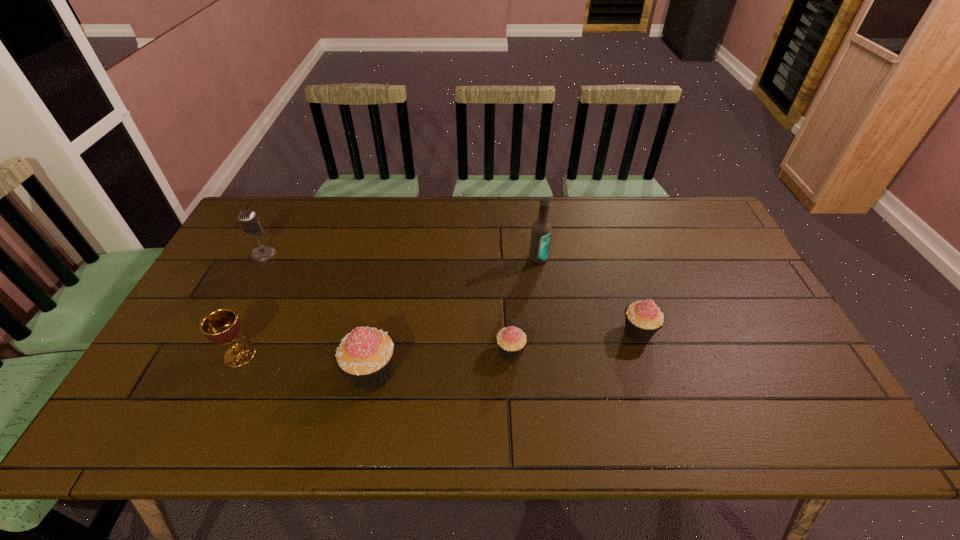
Find the location of a particular element. This screenshot has height=540, width=960. object that is at the near left corner is located at coordinates (222, 326).

Image resolution: width=960 pixels, height=540 pixels. I want to click on vacant space at the far edge of the desktop, so click(346, 198).

In the image, there is a desktop. At what (x,y) coordinates should I click in order to perform the action: click on vacant space at the near edge. Please return your answer as a coordinate pair (x, y). The width and height of the screenshot is (960, 540). Looking at the image, I should click on click(x=574, y=384).

This screenshot has width=960, height=540. I want to click on vacant area at the left edge, so click(202, 293).

Find the location of a particular element. The image size is (960, 540). vacant space at the right edge is located at coordinates (715, 305).

Find the location of a particular element. free space at the far left corner is located at coordinates tap(287, 208).

This screenshot has height=540, width=960. In the image, there is a desktop. In order to click on vacant space at the near right corner in this screenshot , I will do `click(789, 382)`.

The height and width of the screenshot is (540, 960). I want to click on empty location between the tallest cupcake and the microphone, so click(x=318, y=314).

This screenshot has height=540, width=960. Find the location of `free spot between the microphone and the second cupcake from left to right`. free spot between the microphone and the second cupcake from left to right is located at coordinates (387, 303).

Locate an element on the screen. The height and width of the screenshot is (540, 960). free spot between the tallest cupcake and the chalice is located at coordinates (306, 364).